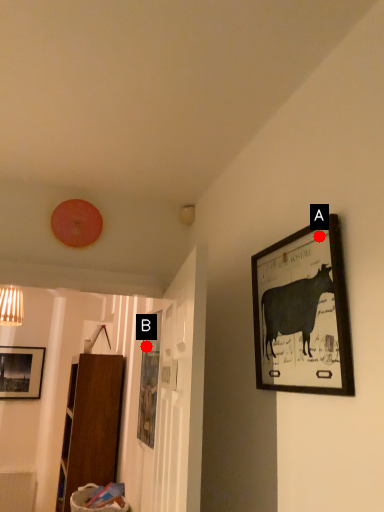
Question: Two points are circled on the image, labeled by A and B beside each circle. Which point appears closest to the camera in this image?

Choices:
 (A) A is closer
 (B) B is closer

Answer: (A)